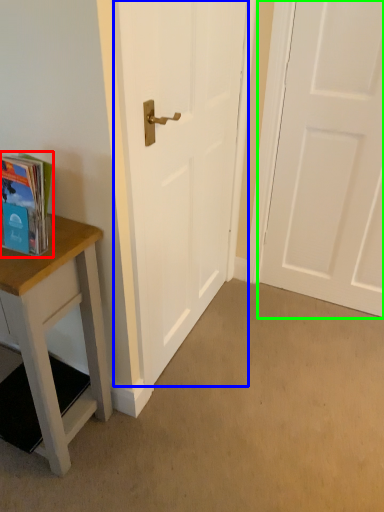
Question: Estimate the real-world distances between objects in this image. Which object is farther from book (highlighted by a red box), door (highlighted by a blue box) or door (highlighted by a green box)?

Choices:
 (A) door
 (B) door

Answer: (B)